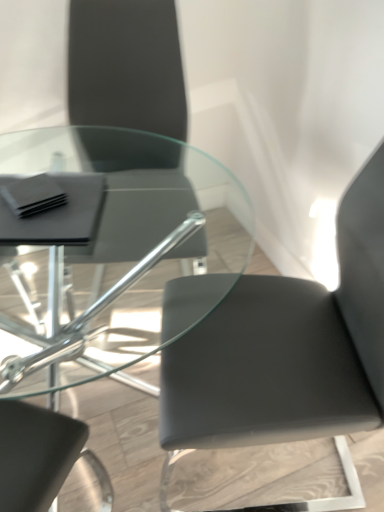
Question: Should I look upward or downward to see matte black chair at upper left, arranged as the first chair when viewed from the left?

Choices:
 (A) down
 (B) up

Answer: (B)

Question: Is matte black chair at upper left, which appears as the 2th chair when viewed from the right, taller than matte black chair at center, the second chair viewed from the left?

Choices:
 (A) no
 (B) yes

Answer: (A)

Question: Is matte black chair at upper left, arranged as the first chair when viewed from the left, completely or partially outside of matte black chair at center, the 1th chair from the right?

Choices:
 (A) yes
 (B) no

Answer: (A)

Question: Does matte black chair at upper left, arranged as the first chair when viewed from the left, have a lesser height compared to matte black chair at center, the 1th chair from the right?

Choices:
 (A) yes
 (B) no

Answer: (A)

Question: Is matte black chair at upper left, which appears as the 2th chair when viewed from the right, turned away from matte black chair at center, the second chair viewed from the left?

Choices:
 (A) no
 (B) yes

Answer: (A)

Question: Is matte black chair at upper left, which appears as the 2th chair when viewed from the right, oriented towards matte black chair at center, the second chair viewed from the left?

Choices:
 (A) yes
 (B) no

Answer: (B)

Question: Is matte black chair at upper left, which appears as the 2th chair when viewed from the right, to the right of matte black chair at center, the second chair viewed from the left, from the viewer's perspective?

Choices:
 (A) no
 (B) yes

Answer: (A)

Question: From a real-world perspective, is matte black chair at center, the second chair viewed from the left, on matte black chair at upper left, which appears as the 2th chair when viewed from the right?

Choices:
 (A) yes
 (B) no

Answer: (B)

Question: Does matte black chair at center, the 1th chair from the right, have a lesser width compared to matte black chair at upper left, which appears as the 2th chair when viewed from the right?

Choices:
 (A) yes
 (B) no

Answer: (B)

Question: Considering the relative sizes of matte black chair at center, the 1th chair from the right, and matte black chair at upper left, which appears as the 2th chair when viewed from the right, in the image provided, is matte black chair at center, the 1th chair from the right, shorter than matte black chair at upper left, which appears as the 2th chair when viewed from the right,?

Choices:
 (A) yes
 (B) no

Answer: (B)

Question: From the image's perspective, is matte black chair at center, the 1th chair from the right, beneath matte black chair at upper left, arranged as the first chair when viewed from the left?

Choices:
 (A) yes
 (B) no

Answer: (A)

Question: Is matte black chair at center, the 1th chair from the right, closer to camera compared to matte black chair at upper left, which appears as the 2th chair when viewed from the right?

Choices:
 (A) yes
 (B) no

Answer: (A)

Question: Can you confirm if matte black chair at center, the second chair viewed from the left, is bigger than matte black chair at upper left, arranged as the first chair when viewed from the left?

Choices:
 (A) no
 (B) yes

Answer: (B)

Question: In terms of height, does matte black chair at upper left, which appears as the 2th chair when viewed from the right, look taller or shorter compared to matte black chair at center, the 1th chair from the right?

Choices:
 (A) tall
 (B) short

Answer: (B)